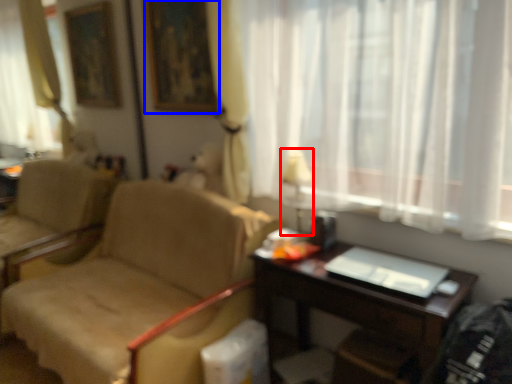
Question: Among these objects, which one is nearest to the camera, table lamp (highlighted by a red box) or picture frame (highlighted by a blue box)?

Choices:
 (A) table lamp
 (B) picture frame

Answer: (A)